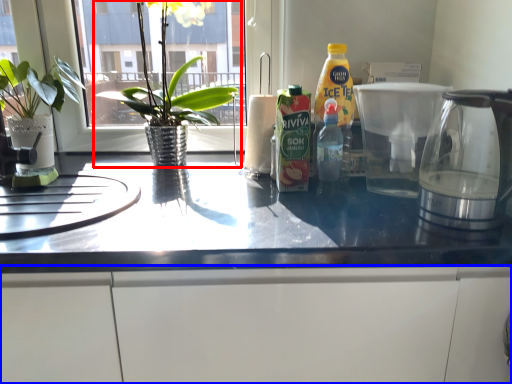
Question: Which object appears farthest to the camera in this image, houseplant (highlighted by a red box) or cabinetry (highlighted by a blue box)?

Choices:
 (A) houseplant
 (B) cabinetry

Answer: (A)